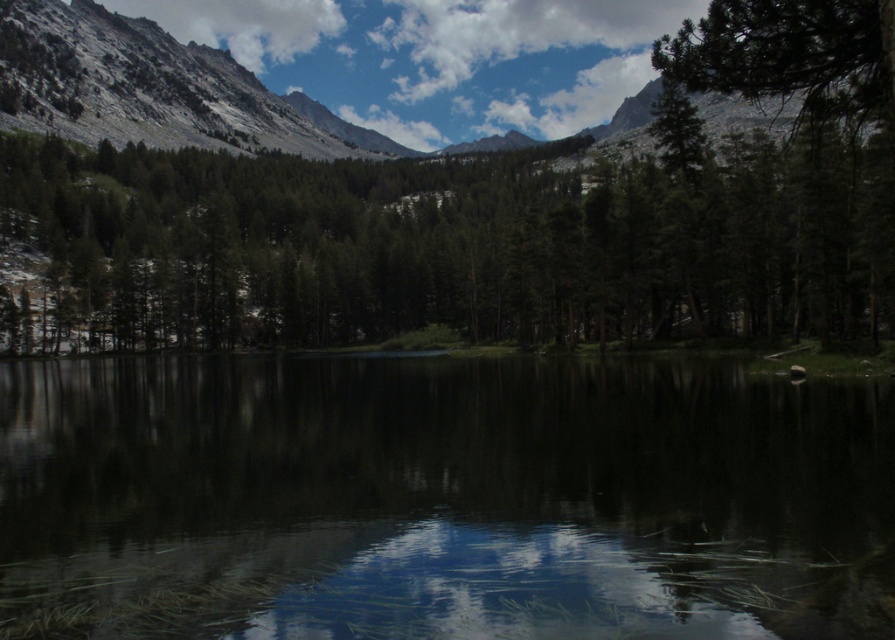
You are standing at the edge of the lake and see the point at coordinates point (x=440, y=499). Is this point located on the smooth reflective water at center?

Yes, the point (x=440, y=499) is on the smooth reflective water at center.

You are planning to place a small wooden boat in the smooth reflective water at center. The boat requires a minimum of 250 feet of open space to avoid hitting the green matte tree at center. Is there enough space?

The smooth reflective water at center and green matte tree at center are 246.63 feet apart. Since the required minimum space is 250 feet, there is not enough space to safely place the boat without risking collision.